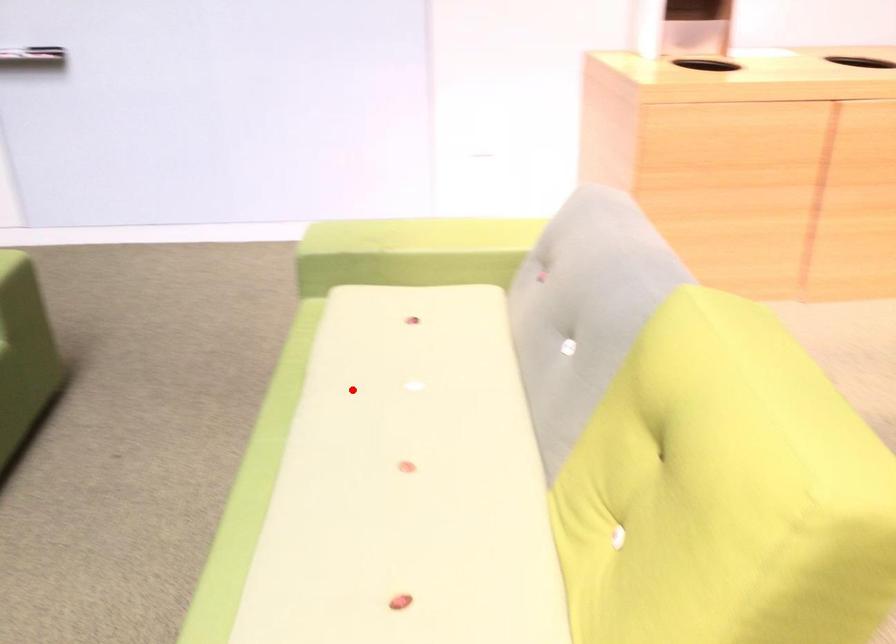
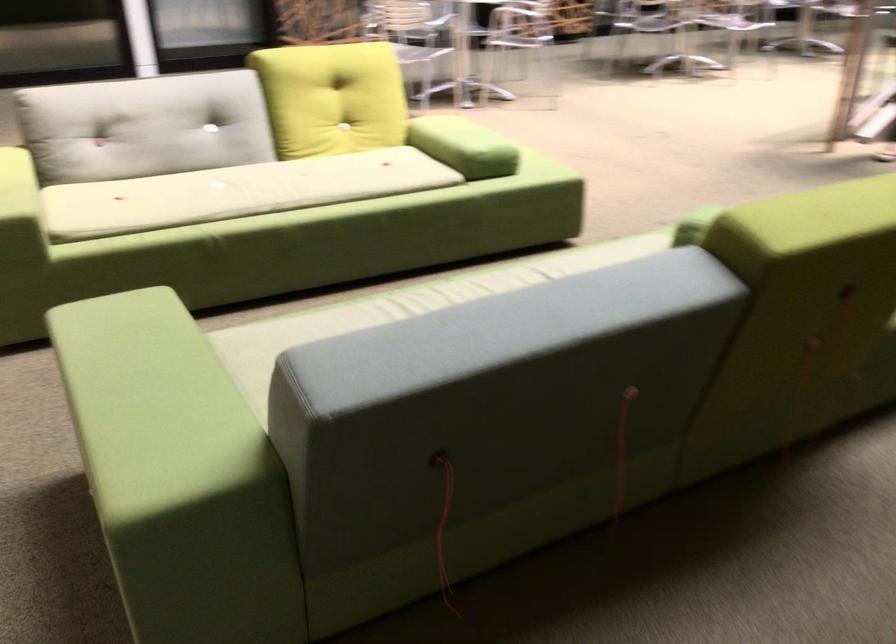
Question: I am providing you with two images of the same scene from different viewpoints. A red point is marked on the first image. Is the red point's position out of view in image 2?

Choices:
 (A) Yes
 (B) No

Answer: (B)